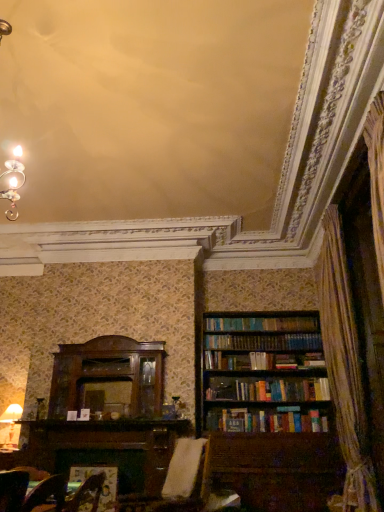
Question: From a real-world perspective, is matte white lampshade at lower left below brown wooden bookcase at right?

Choices:
 (A) yes
 (B) no

Answer: (A)

Question: Is brown wooden bookcase at right located within matte white lampshade at lower left?

Choices:
 (A) yes
 (B) no

Answer: (B)

Question: Is matte white lampshade at lower left outside of brown wooden bookcase at right?

Choices:
 (A) no
 (B) yes

Answer: (B)

Question: Considering the relative sizes of matte white lampshade at lower left and brown wooden bookcase at right in the image provided, is matte white lampshade at lower left bigger than brown wooden bookcase at right?

Choices:
 (A) yes
 (B) no

Answer: (B)

Question: From the image's perspective, is matte white lampshade at lower left located beneath brown wooden bookcase at right?

Choices:
 (A) yes
 (B) no

Answer: (A)

Question: From a real-world perspective, is matte white lampshade at lower left over brown wooden bookcase at right?

Choices:
 (A) no
 (B) yes

Answer: (A)

Question: Does velvet brown armchair at lower center appear on the left side of brown wooden bookcase at right?

Choices:
 (A) no
 (B) yes

Answer: (B)

Question: From a real-world perspective, is velvet brown armchair at lower center located higher than brown wooden bookcase at right?

Choices:
 (A) yes
 (B) no

Answer: (B)

Question: From a real-world perspective, is velvet brown armchair at lower center positioned under brown wooden bookcase at right based on gravity?

Choices:
 (A) yes
 (B) no

Answer: (A)

Question: Does velvet brown armchair at lower center have a larger size compared to brown wooden bookcase at right?

Choices:
 (A) yes
 (B) no

Answer: (B)

Question: Can you confirm if velvet brown armchair at lower center is smaller than brown wooden bookcase at right?

Choices:
 (A) yes
 (B) no

Answer: (A)

Question: Is velvet brown armchair at lower center turned away from brown wooden bookcase at right?

Choices:
 (A) no
 (B) yes

Answer: (A)

Question: Considering the relative sizes of white fabric swivel chair at center and brown wooden bookcase at right in the image provided, is white fabric swivel chair at center smaller than brown wooden bookcase at right?

Choices:
 (A) yes
 (B) no

Answer: (A)